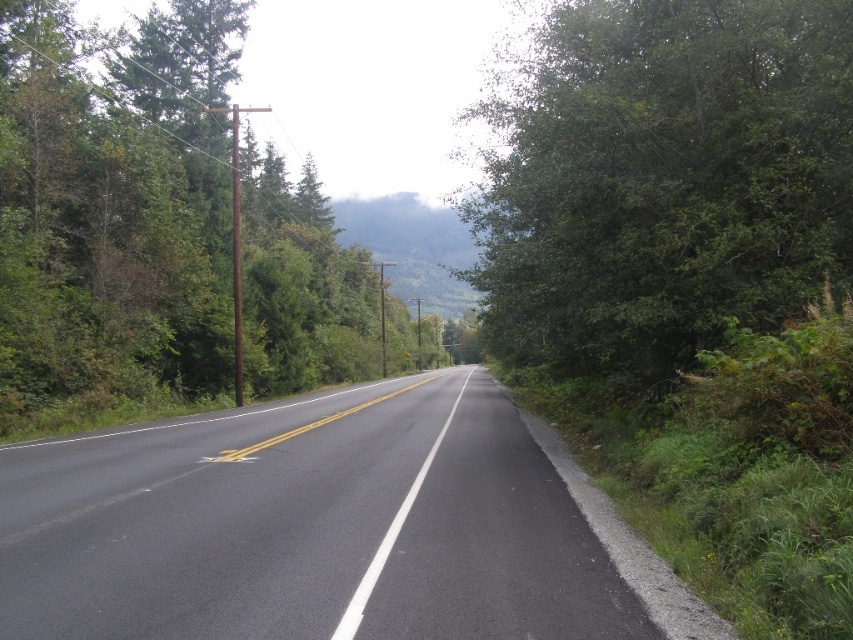
Can you confirm if black asphalt road at center is positioned to the right of green leafy tree at left?

Yes, black asphalt road at center is to the right of green leafy tree at left.

Is black asphalt road at center thinner than green leafy tree at left?

Indeed, black asphalt road at center has a lesser width compared to green leafy tree at left.

You are a GUI agent. You are given a task and a screenshot of the screen. Output one action in this format:
    pyautogui.click(x=<x>, y=<y>)
    Task: Click on the black asphalt road at center
    
    Given the screenshot: What is the action you would take?
    pyautogui.click(x=306, y=525)

Find the location of a particular element. The image size is (853, 640). black asphalt road at center is located at coordinates (306, 525).

Is point (302, 413) in front of point (688, 227)?

No, it is not.

Between point (231, 630) and point (679, 17), which one is positioned in front?

Point (231, 630) is more forward.

This screenshot has width=853, height=640. What are the coordinates of `black asphalt road at center` in the screenshot? It's located at (306, 525).

Between green leafy tree at left and green leafy tree at right, which one is positioned higher?

green leafy tree at left

Does green leafy tree at left appear under green leafy tree at right?

No, green leafy tree at left is not below green leafy tree at right.

Which is behind, point (119, 330) or point (819, 154)?

The point (119, 330) is behind.

The width and height of the screenshot is (853, 640). Identify the location of green leafy tree at left. (115, 214).